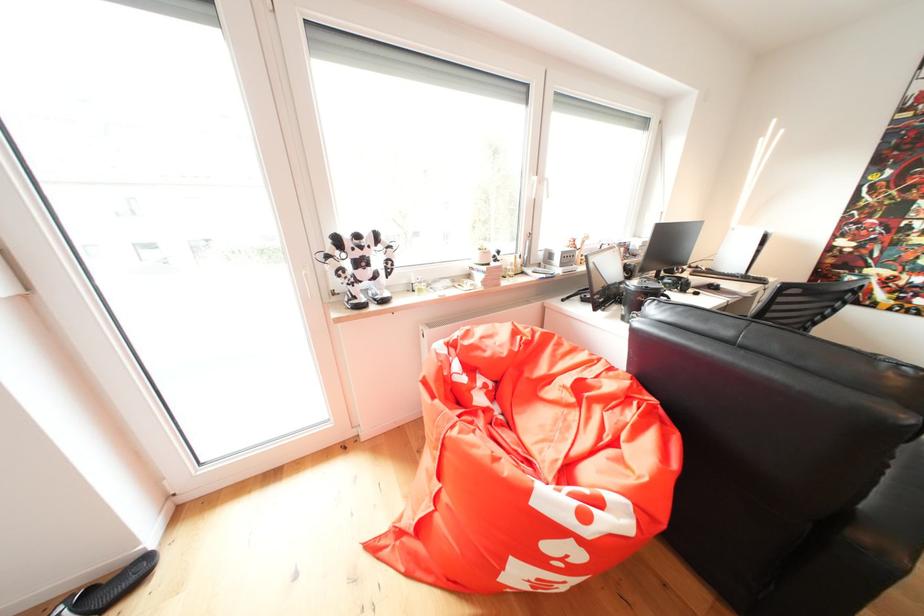
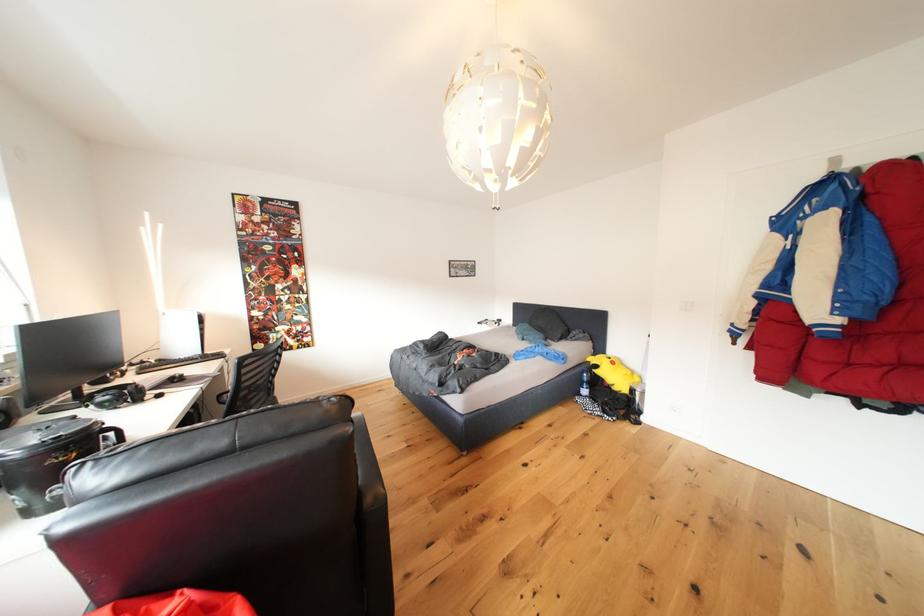
Question: The first image is from the beginning of the video and the second image is from the end. How did the camera likely rotate when shooting the video?

Choices:
 (A) Left
 (B) Right
 (C) Up
 (D) Down

Answer: (B)